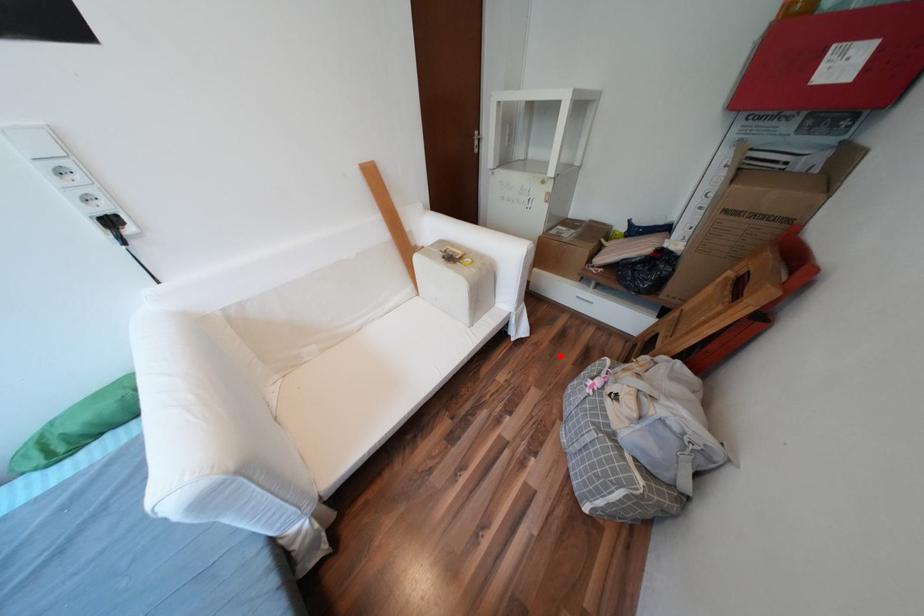
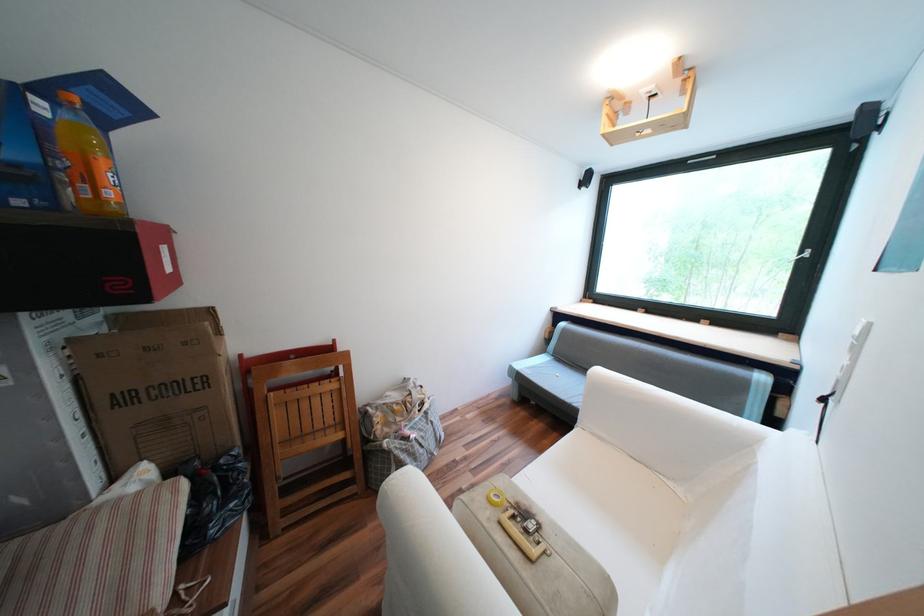
Locate, in the second image, the point that corresponds to the highlighted location in the first image.

(387, 548)